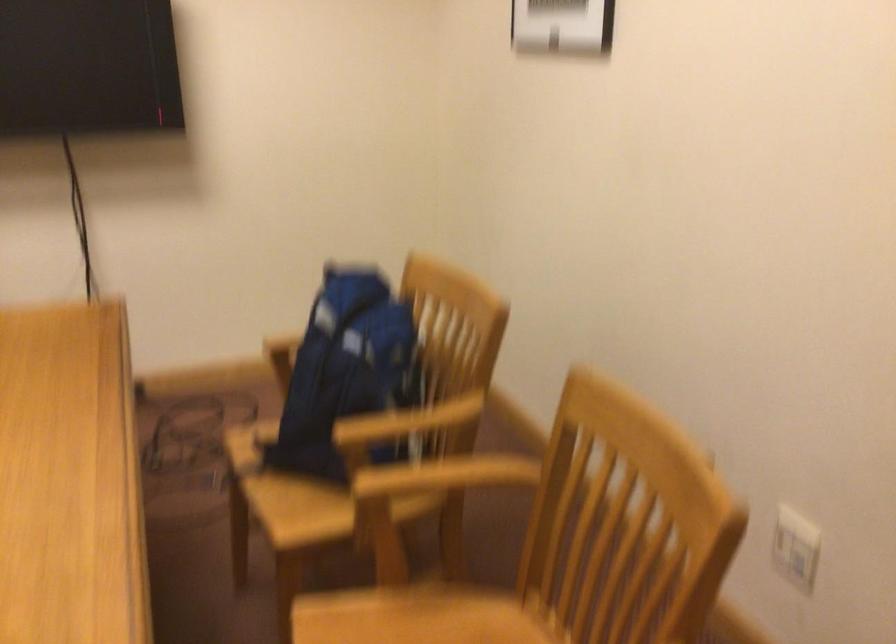
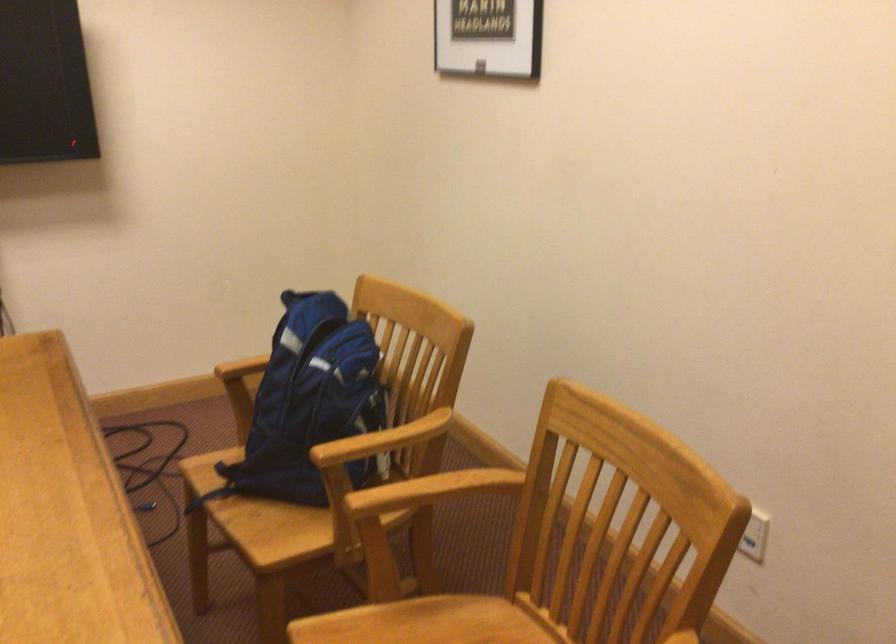
In the second image, find the point that corresponds to (x=407, y=422) in the first image.

(383, 440)